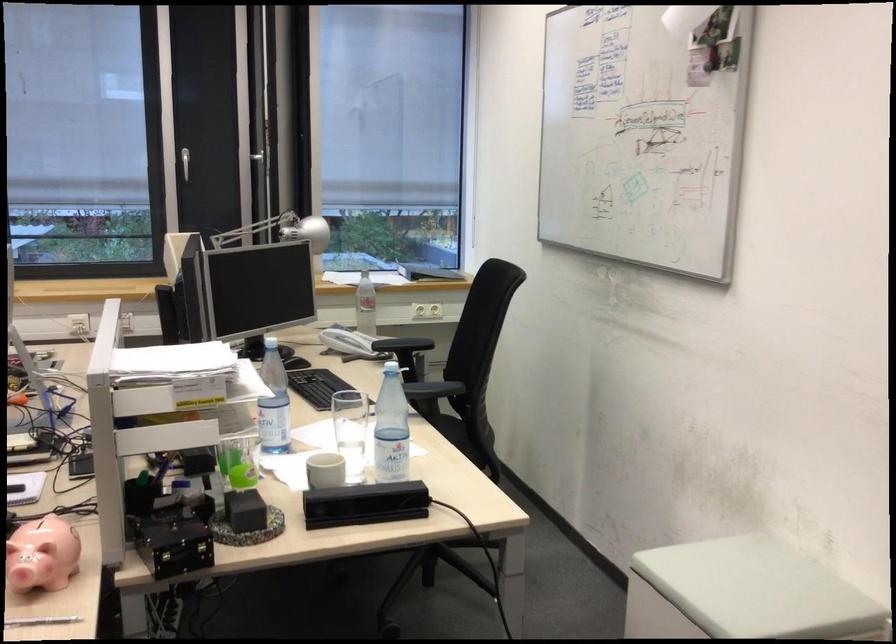
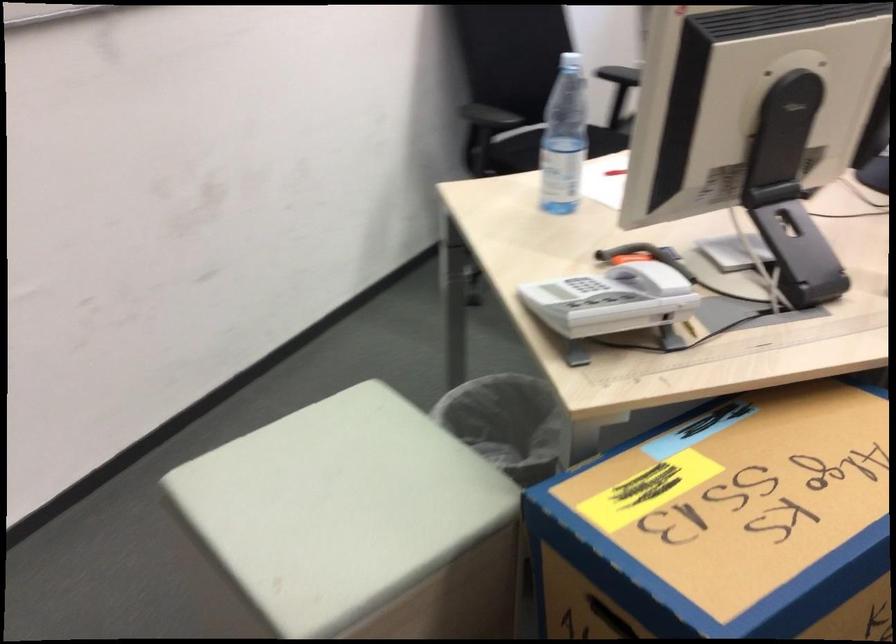
First-person continuous shooting, in which direction is the camera rotating?

The camera rotated toward left-down.